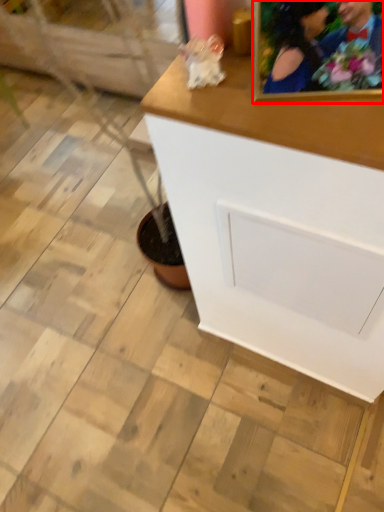
Question: From the image's perspective, what is the correct spatial positioning of picture frame (annotated by the red box) in reference to table?

Choices:
 (A) above
 (B) below

Answer: (A)